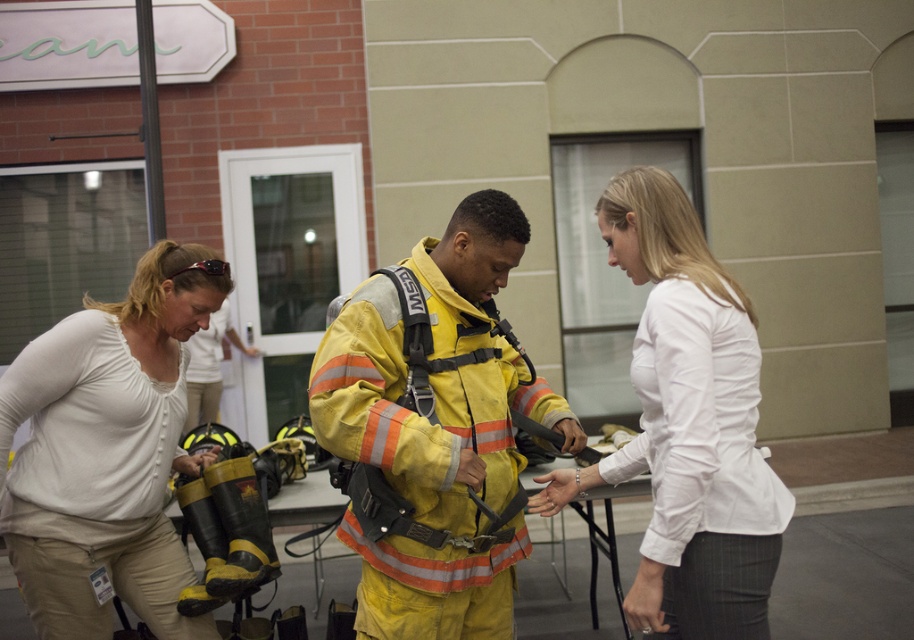
You are a safety inspector standing 3 meters away from the yellow reflective uniform at center. Can you safely approach within 1 meter to inspect it without violating safety protocols?

The yellow reflective uniform at center is 2.54 meters away from the camera. Since you are standing 3 meters away, you need to move closer by 0.46 meters to reach 2.54 meters, which is within the 1 meter inspection distance. Therefore, you can safely approach within 1 meter to inspect it without violating safety protocols.

You are an observer in the training facility. You notice the light beige pants at lower left and the yellow reflective jacket at center. Which object occupies more space in the image?

The light beige pants at lower left is larger in size than the yellow reflective jacket at center, so it occupies more space in the image.